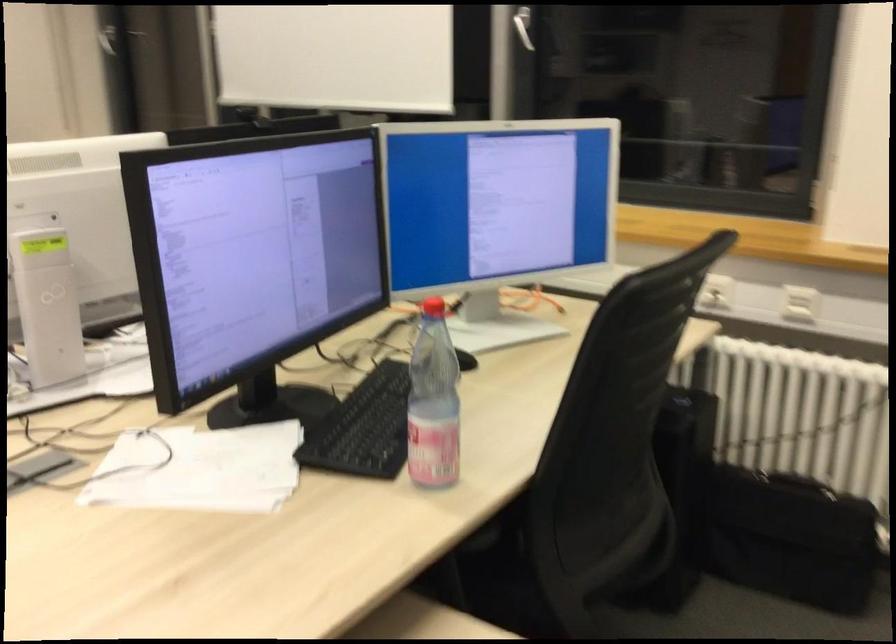
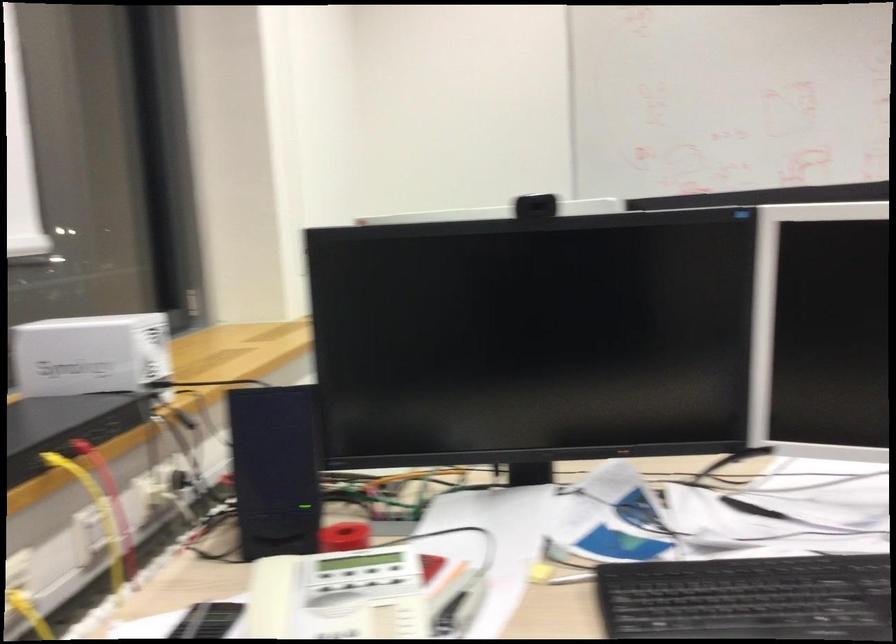
Question: I am providing you with two images of the same scene from different viewpoints. After the viewpoint changes to image2, which objects are now occluded?

Choices:
 (A) yellow spray nozzle
 (B) telephone handset
 (C) black computer speaker
 (D) plastic water bottle

Answer: (D)